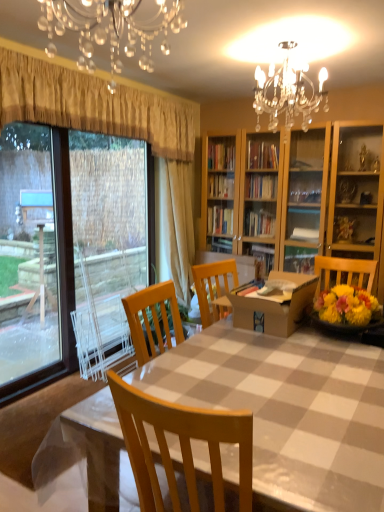
Question: Would you say checkered plastic table at center is part of crystal glass chandelier at upper center's contents?

Choices:
 (A) yes
 (B) no

Answer: (B)

Question: Can you confirm if crystal glass chandelier at upper center is positioned to the left of checkered plastic table at center?

Choices:
 (A) yes
 (B) no

Answer: (A)

Question: Is crystal glass chandelier at upper center at the right side of checkered plastic table at center?

Choices:
 (A) yes
 (B) no

Answer: (B)

Question: Is crystal glass chandelier at upper center next to checkered plastic table at center and touching it?

Choices:
 (A) no
 (B) yes

Answer: (A)

Question: Is crystal glass chandelier at upper center taller than checkered plastic table at center?

Choices:
 (A) yes
 (B) no

Answer: (B)

Question: Looking at their shapes, would you say checkered plastic table at center is wider or thinner than crystal glass chandelier at upper center?

Choices:
 (A) wide
 (B) thin

Answer: (A)

Question: From the image's perspective, is checkered plastic table at center positioned above or below crystal glass chandelier at upper center?

Choices:
 (A) below
 (B) above

Answer: (A)

Question: Considering their positions, is checkered plastic table at center located in front of or behind crystal glass chandelier at upper center?

Choices:
 (A) front
 (B) behind

Answer: (B)

Question: Considering the positions of checkered plastic table at center and crystal glass chandelier at upper center in the image, is checkered plastic table at center bigger or smaller than crystal glass chandelier at upper center?

Choices:
 (A) big
 (B) small

Answer: (A)

Question: From the image's perspective, relative to beige fabric curtain at center, which appears as the 2th curtain when viewed from the front, is crystal glass chandelier at upper center above or below?

Choices:
 (A) above
 (B) below

Answer: (A)

Question: In terms of width, does crystal glass chandelier at upper center look wider or thinner when compared to beige fabric curtain at center, which appears as the 2th curtain when viewed from the front?

Choices:
 (A) wide
 (B) thin

Answer: (A)

Question: Considering the positions of crystal glass chandelier at upper center and beige fabric curtain at center, which appears as the 2th curtain when viewed from the front, in the image, is crystal glass chandelier at upper center taller or shorter than beige fabric curtain at center, which appears as the 2th curtain when viewed from the front,?

Choices:
 (A) tall
 (B) short

Answer: (B)

Question: Is crystal glass chandelier at upper center inside or outside of beige fabric curtain at center, the 1th curtain when ordered from back to front?

Choices:
 (A) outside
 (B) inside

Answer: (A)

Question: Is point (64, 335) positioned closer to the camera than point (359, 437)?

Choices:
 (A) farther
 (B) closer

Answer: (A)

Question: Looking at their shapes, would you say clear glass window at left is wider or thinner than checkered plastic table at center?

Choices:
 (A) wide
 (B) thin

Answer: (B)